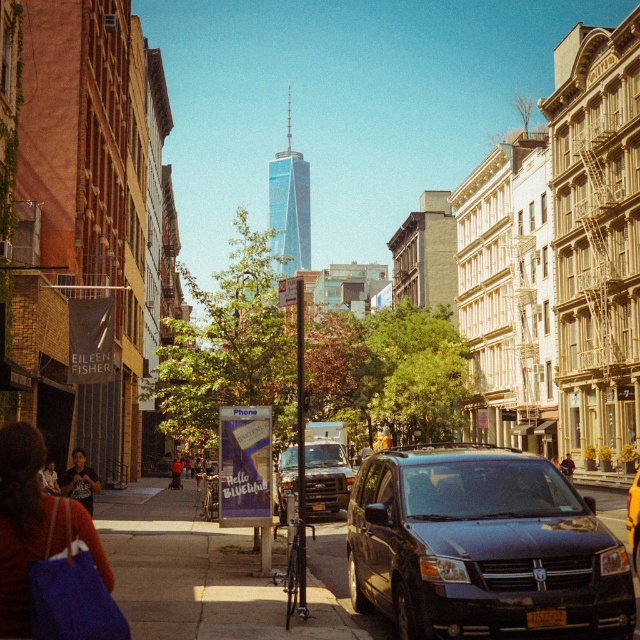
You are a delivery person trying to reach the matte black van at center parked on the sidewalk. There is a matte purple bag at lower left in your way. Which direction should you move to avoid the bag and reach the van?

The matte purple bag at lower left is on the left side of the matte black van at center, so you should move to the right to avoid the bag and reach the van.

You are standing on the sidewalk in front of the Eileen Fisher store and want to walk to the One World Trade Center. There are two points marked on the path ahead of you. Which point, point (136,561) or point (326,465), is closer to you?

Point (136,561) is closer to you than point (326,465).